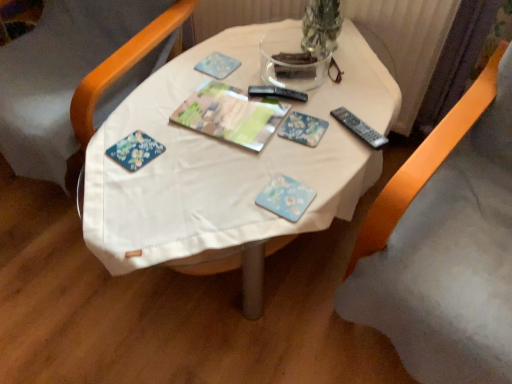
Question: Is floral-patterned paper at center, placed as the 2th paperback book when sorted from bottom to top, at the back of blue floral coaster at center, the 2th paperback book viewed from the back?

Choices:
 (A) yes
 (B) no

Answer: (A)

Question: Considering the relative sizes of blue floral coaster at center, the 2th paperback book viewed from the back, and floral-patterned paper at center, positioned as the first paperback book in back-to-front order, in the image provided, is blue floral coaster at center, the 2th paperback book viewed from the back, smaller than floral-patterned paper at center, positioned as the first paperback book in back-to-front order,?

Choices:
 (A) yes
 (B) no

Answer: (A)

Question: From the image's perspective, is blue floral coaster at center, arranged as the first paperback book when ordered from the bottom, beneath floral-patterned paper at center, placed as the 2th paperback book when sorted from bottom to top?

Choices:
 (A) no
 (B) yes

Answer: (B)

Question: Are blue floral coaster at center, the 2th paperback book viewed from the back, and floral-patterned paper at center, acting as the first paperback book starting from the top, far apart?

Choices:
 (A) no
 (B) yes

Answer: (A)

Question: From the image's perspective, is blue floral coaster at center, arranged as the first paperback book when ordered from the bottom, on top of floral-patterned paper at center, acting as the first paperback book starting from the top?

Choices:
 (A) no
 (B) yes

Answer: (A)

Question: From a real-world perspective, is orange fabric chair at lower right, the second chair when ordered from left to right, physically located above or below white fabric table at center?

Choices:
 (A) below
 (B) above

Answer: (B)

Question: Considering the positions of orange fabric chair at lower right, marked as the 1th chair in a right-to-left arrangement, and white fabric table at center in the image, is orange fabric chair at lower right, marked as the 1th chair in a right-to-left arrangement, taller or shorter than white fabric table at center?

Choices:
 (A) tall
 (B) short

Answer: (A)

Question: In terms of size, does orange fabric chair at lower right, the second chair when ordered from left to right, appear bigger or smaller than white fabric table at center?

Choices:
 (A) small
 (B) big

Answer: (B)

Question: From the image's perspective, relative to white fabric table at center, is orange fabric chair at lower right, marked as the 1th chair in a right-to-left arrangement, above or below?

Choices:
 (A) below
 (B) above

Answer: (A)

Question: Is floral-patterned paper at center, positioned as the first paperback book in back-to-front order, wider or thinner than black plastic remote at right?

Choices:
 (A) thin
 (B) wide

Answer: (B)

Question: Relative to black plastic remote at right, is floral-patterned paper at center, the second paperback book when ordered from front to back, in front or behind?

Choices:
 (A) behind
 (B) front

Answer: (A)

Question: In terms of height, does floral-patterned paper at center, the second paperback book when ordered from front to back, look taller or shorter compared to black plastic remote at right?

Choices:
 (A) tall
 (B) short

Answer: (B)

Question: From a real-world perspective, relative to black plastic remote at right, is floral-patterned paper at center, the second paperback book when ordered from front to back, vertically above or below?

Choices:
 (A) below
 (B) above

Answer: (A)

Question: From a real-world perspective, is wooden chair at left, the 1th chair in the left-to-right sequence, above or below black plastic remote at right?

Choices:
 (A) above
 (B) below

Answer: (B)

Question: From the image's perspective, is wooden chair at left, the 1th chair in the left-to-right sequence, located above or below black plastic remote at right?

Choices:
 (A) above
 (B) below

Answer: (A)